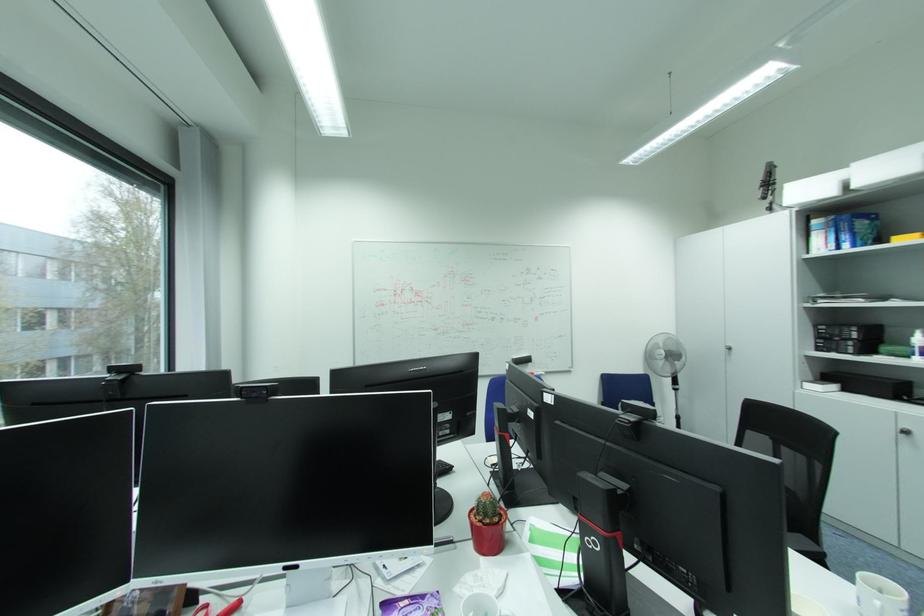
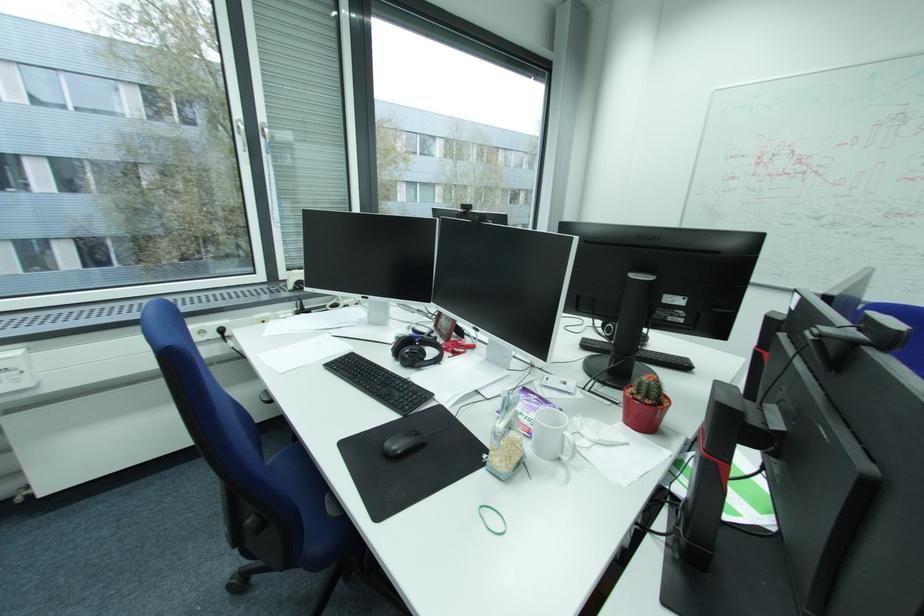
In the second image, find the point that corresponds to [470,371] in the first image.

(725, 253)